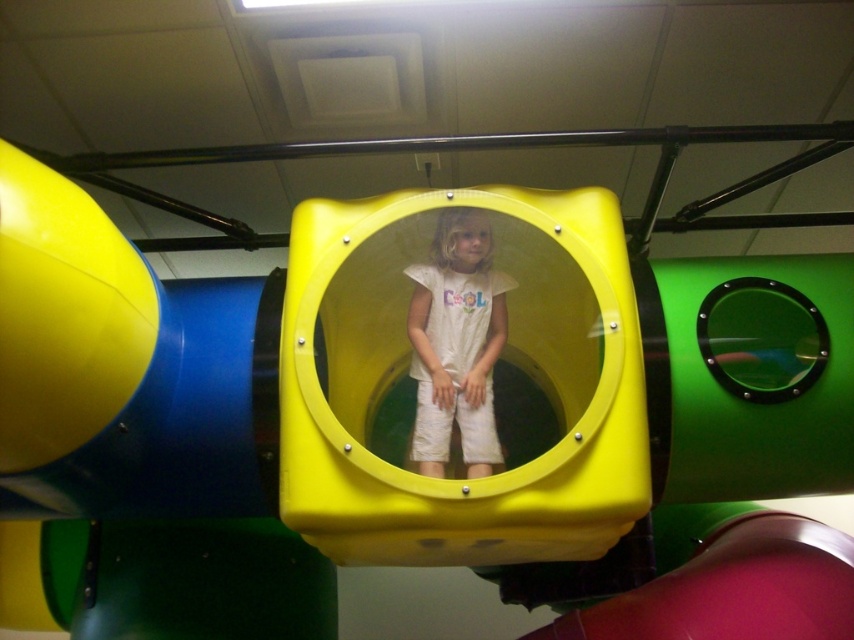
You are a photographer trying to capture the best angle of the play structure. You notice two points marked on the structure at coordinates point [639,616] and point [433,330]. Which point is closer to the camera?

Point [639,616] is further to the camera than point [433,330], so the closer point to the camera is point [433,330].